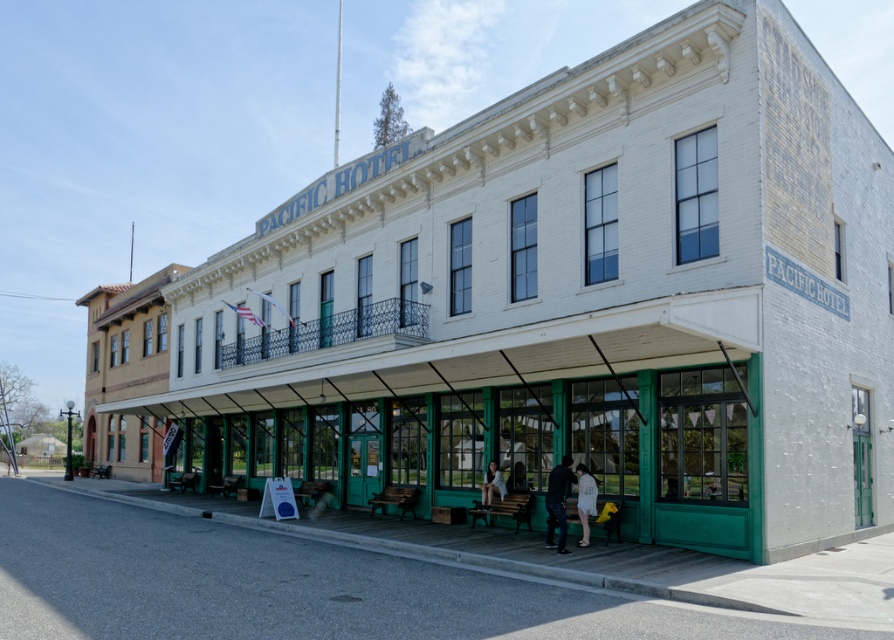
You are a guest at the Pacific Hotel and notice two items at the lower center of the scene. Which item is taller between the dark blue jeans at lower center and the white cotton dress at lower center?

The dark blue jeans at lower center is taller than the white cotton dress at lower center.

You are a guest arriving at the Pacific Hotel and see the dark blue jeans at lower center and the light brown wooden bench at lower center. Which object is closer to the entrance?

The dark blue jeans at lower center is closer to the entrance because it is in front of the light brown wooden bench at lower center.